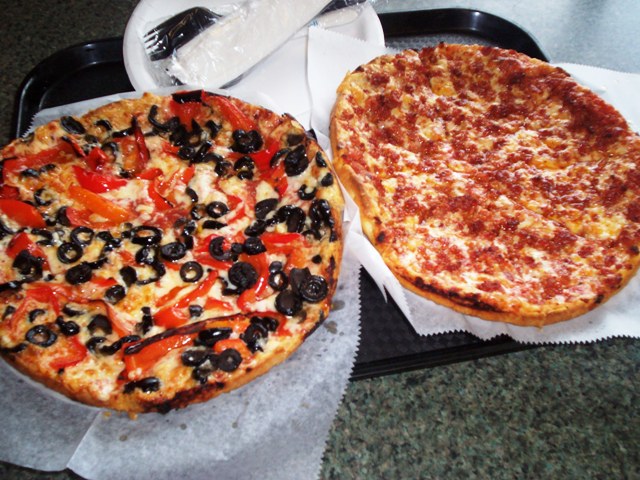
This screenshot has width=640, height=480. Identify the location of sheet. (591, 328).